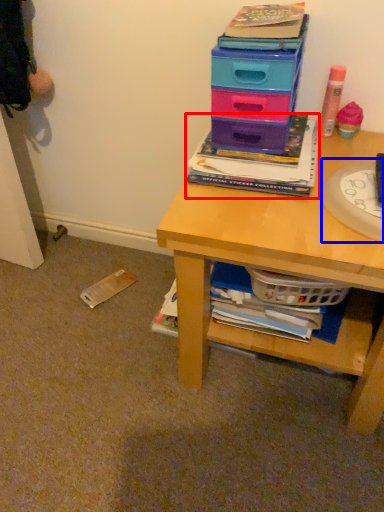
Question: Which point is further to the camera, book (highlighted by a red box) or paper plate (highlighted by a blue box)?

Choices:
 (A) book
 (B) paper plate

Answer: (A)